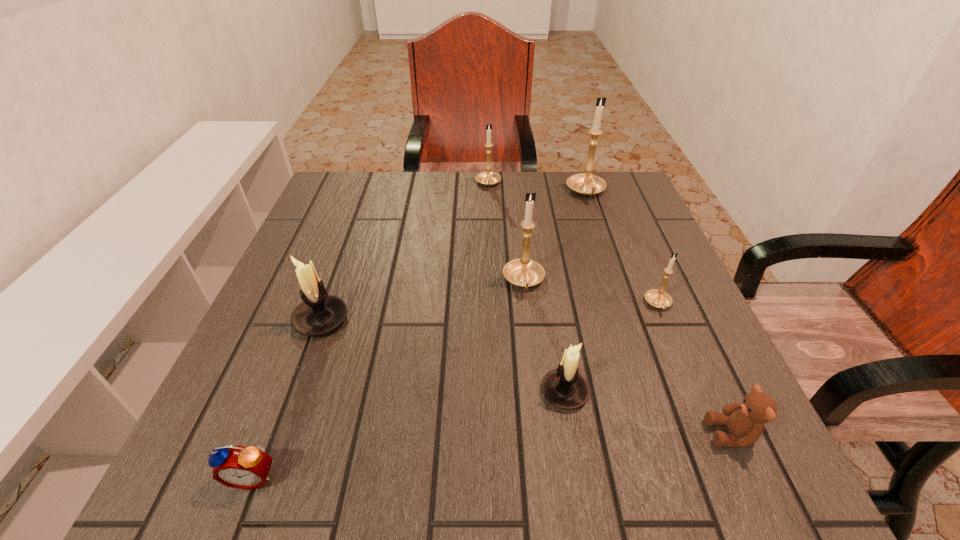
Point out which gold candle holder is positioned as the third nearest to the farther white candle holder. Please provide its 2D coordinates. Your answer should be formatted as a tuple, i.e. [(x, y)], where the tuple contains the x and y coordinates of a point satisfying the conditions above.

[(657, 298)]

The image size is (960, 540). I want to click on vacant area that satisfies the following two spatial constraints: 1. on the handle side of the nearer white candle holder; 2. on the left side of the second tallest candle holder, so click(x=536, y=392).